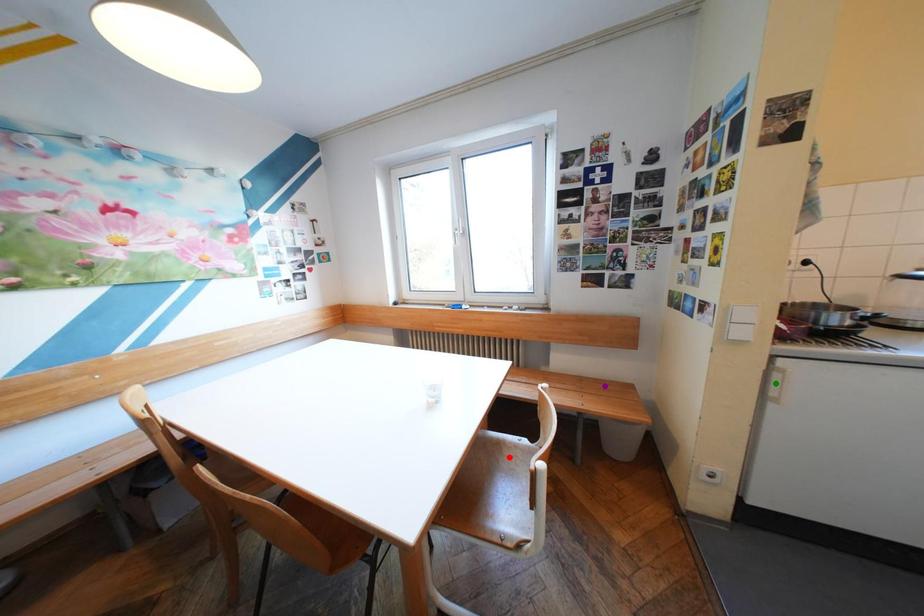
Order these from farthest to nearest:
A) red point
B) purple point
C) green point

purple point
red point
green point